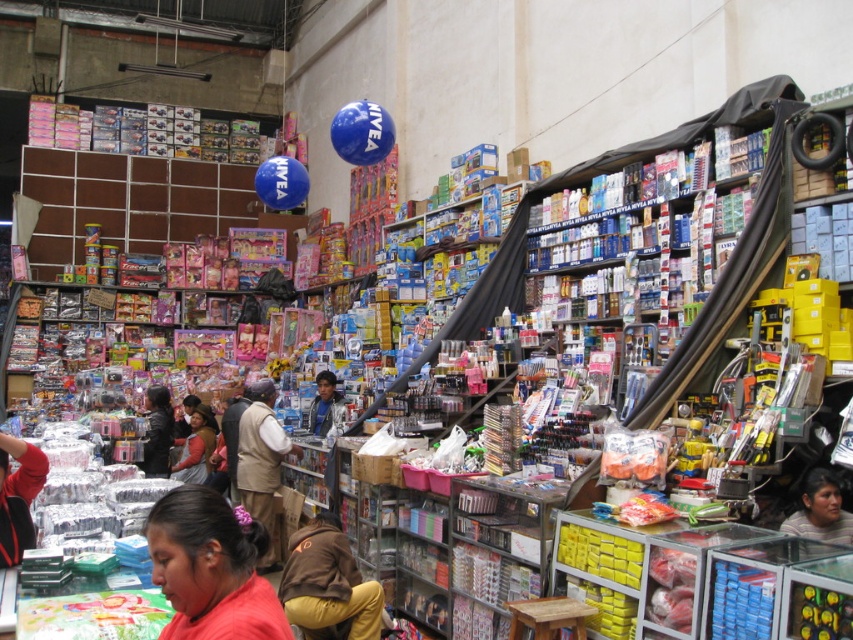
Question: Which object is positioned farthest from the matte red shirt at lower left?

Choices:
 (A) brown fabric vest at center
 (B) matte brown jacket at center

Answer: (B)

Question: Which object appears farthest from the camera in this image?

Choices:
 (A) matte red shirt at lower left
 (B) brown fabric vest at center

Answer: (B)

Question: Among these points, which one is nearest to the camera?

Choices:
 (A) [273, 541]
 (B) [207, 468]

Answer: (A)

Question: Is the position of brown fabric vest at center less distant than that of matte brown jacket at center?

Choices:
 (A) yes
 (B) no

Answer: (A)

Question: Where is matte red shirt at lower left located in relation to matte brown jacket at center in the image?

Choices:
 (A) left
 (B) right

Answer: (B)

Question: Can you confirm if matte red shirt at lower left is smaller than brown fabric vest at center?

Choices:
 (A) yes
 (B) no

Answer: (B)